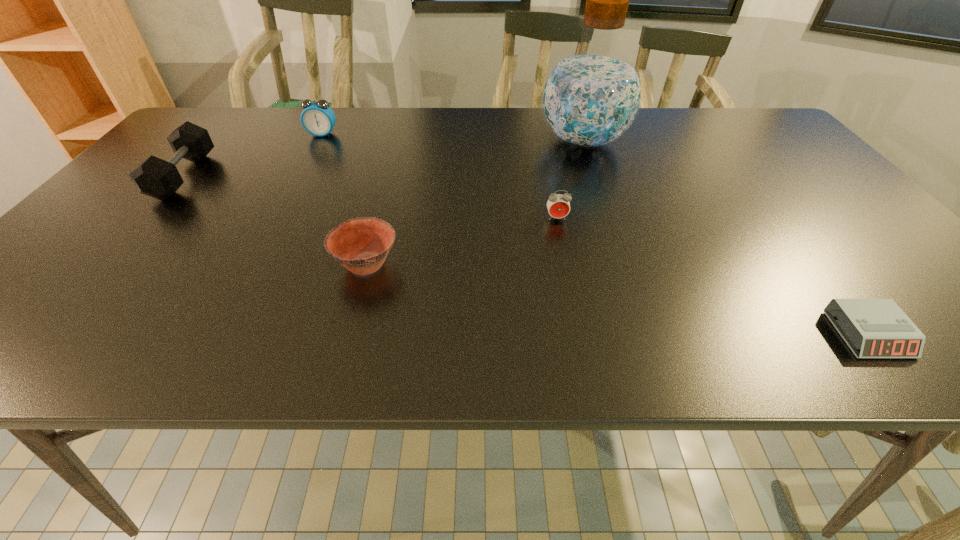
Find the location of a particular element. This screenshot has width=960, height=540. free spot between the water jug and the dumbbell is located at coordinates (383, 159).

Where is `vacant region between the fifth object from right to left and the second nearest alarm clock`? vacant region between the fifth object from right to left and the second nearest alarm clock is located at coordinates (440, 176).

The width and height of the screenshot is (960, 540). Identify the location of vacant area that lies between the tallest object and the shortest alarm clock. (726, 238).

This screenshot has width=960, height=540. In order to click on unoccupied position between the bowl and the tallest object in this screenshot , I will do `click(475, 203)`.

I want to click on free space between the tallest object and the second tallest alarm clock, so click(570, 180).

This screenshot has width=960, height=540. Identify the location of vacant space that is in between the tallest alarm clock and the dumbbell. (253, 155).

This screenshot has width=960, height=540. I want to click on vacant region between the second tallest alarm clock and the water jug, so click(570, 180).

You are a GUI agent. You are given a task and a screenshot of the screen. Output one action in this format:
    pyautogui.click(x=<x>, y=<y>)
    Task: Click on the object that is the nearest to the leftmost object
    The height and width of the screenshot is (540, 960).
    Given the screenshot: What is the action you would take?
    pyautogui.click(x=317, y=118)

Choose which object is the fourth nearest neighbor to the fourth object from right to left. Please provide its 2D coordinates. Your answer should be formatted as a tuple, i.e. [(x, y)], where the tuple contains the x and y coordinates of a point satisfying the conditions above.

[(317, 118)]

The image size is (960, 540). Find the location of `alarm clock that stands as the third closest to the water jug`. alarm clock that stands as the third closest to the water jug is located at coordinates (317, 118).